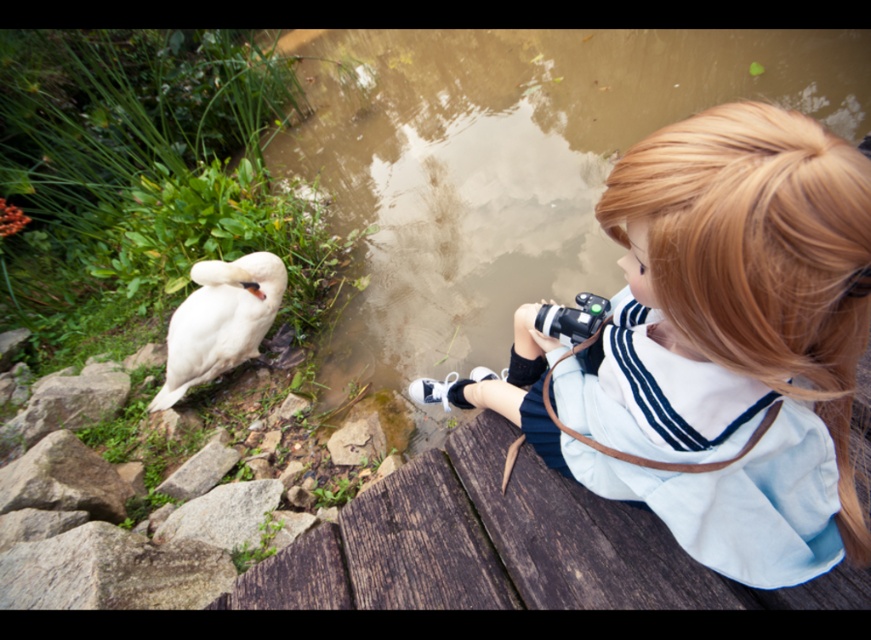
Question: Based on their relative distances, which object is nearer to the white matte swan at left?

Choices:
 (A) light blue fabric at center
 (B) black rubber camera at center

Answer: (A)

Question: Does white matte swan at left appear on the right side of black rubber camera at center?

Choices:
 (A) yes
 (B) no

Answer: (B)

Question: Which point is closer to the camera?

Choices:
 (A) black rubber camera at center
 (B) white matte swan at left

Answer: (A)

Question: Observing the image, what is the correct spatial positioning of light blue fabric at center in reference to white matte swan at left?

Choices:
 (A) below
 (B) above

Answer: (A)

Question: Which object is positioned closest to the white matte swan at left?

Choices:
 (A) light blue fabric at center
 (B) black rubber camera at center

Answer: (A)

Question: Does light blue fabric at center appear over white matte swan at left?

Choices:
 (A) no
 (B) yes

Answer: (A)